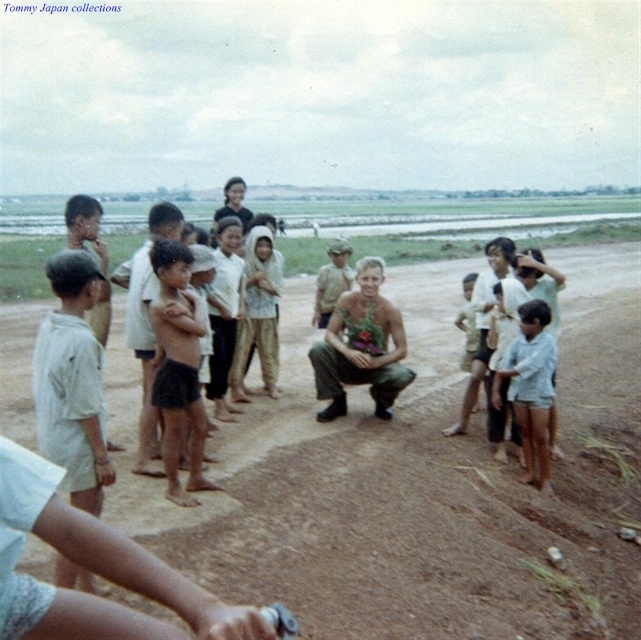
You are a photographer trying to capture a group photo of the white cotton shirt at left and the dark brown skin at center. Based on their size in the image, which subject should you focus on first to ensure they are in frame?

The white cotton shirt at left occupies less space than dark brown skin at center, so you should focus on the dark brown skin at center first since it takes up more of the frame and will be easier to center initially.

You are a photographer standing at the bottom left corner of the image. You want to take a picture of the camouflage fabric man at center. Which direction should you move to get him in frame?

Since the camouflage fabric man at center is located at point (x=362, y=346), you should move towards the center of the image to get him in frame.

You are a photographer trying to capture a group photo of the white cotton shirt at left and dark brown skin at center. Based on their heights, which one should you position closer to the camera to ensure both are fully visible in the frame?

The white cotton shirt at left is much taller than the dark brown skin at center, so you should position the dark brown skin at center closer to the camera to ensure both are fully visible in the frame.